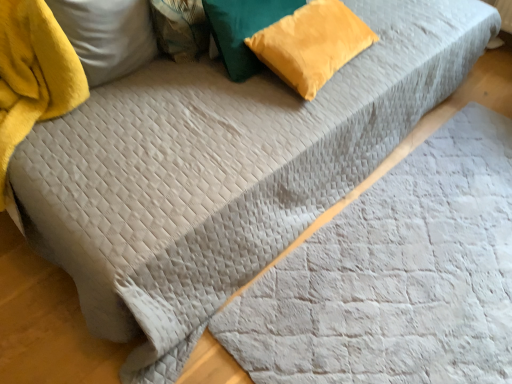
What are the coordinates of `vacant space in gray quilted blanket at center (from a real-world perspective)` in the screenshot? It's located at (407, 291).